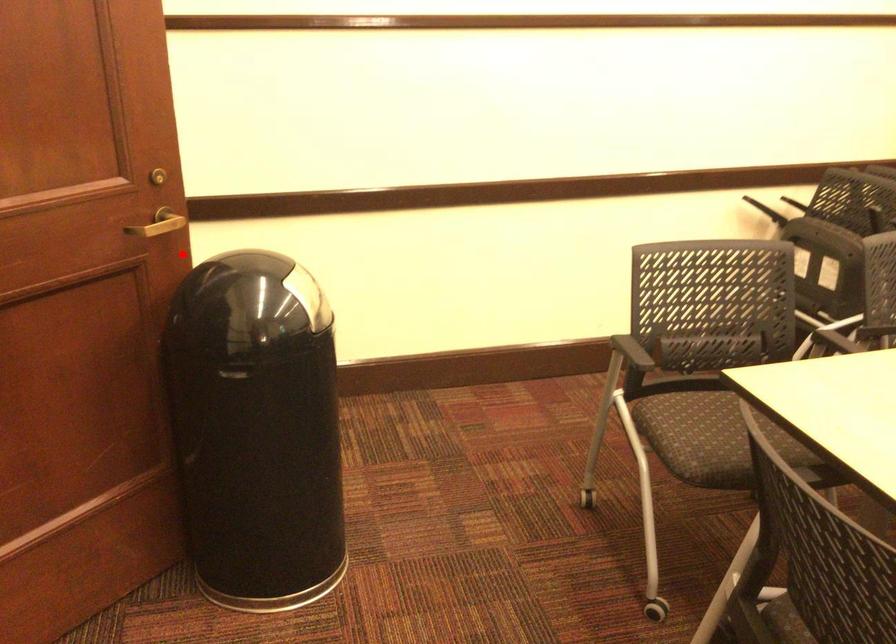
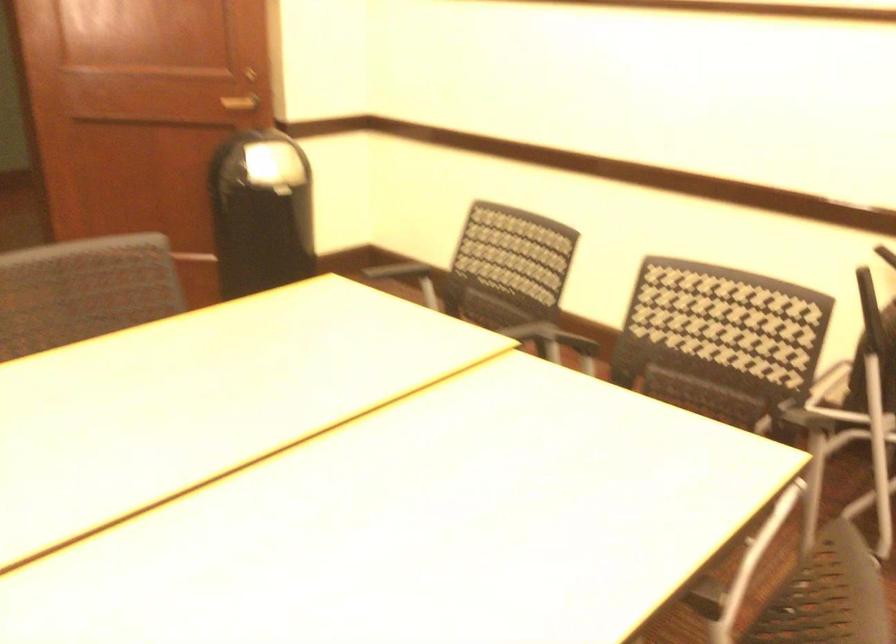
Question: A red point is marked in image1. In image2, is the corresponding 3D point closer to the camera or farther? Reply with the corresponding letter.

Choices:
 (A) The corresponding 3D point is closer.
 (B) The corresponding 3D point is farther.

Answer: (B)